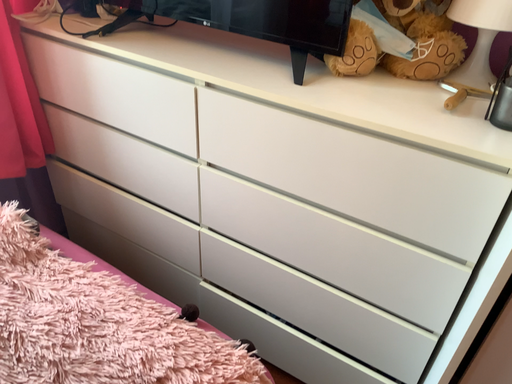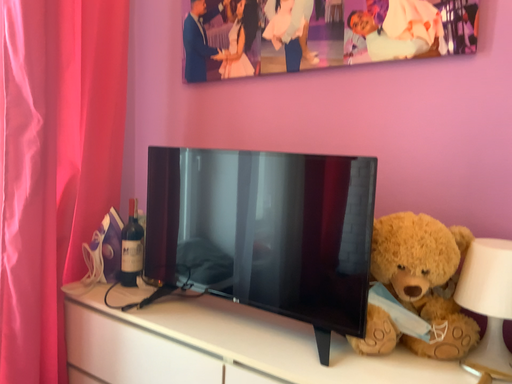
Question: How did the camera likely rotate when shooting the video?

Choices:
 (A) rotated downward
 (B) rotated upward

Answer: (B)